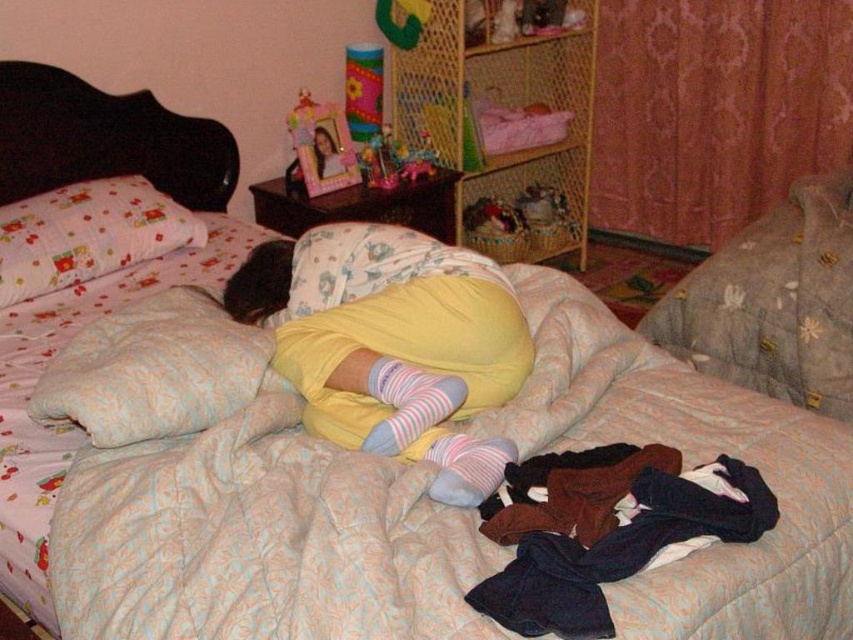
Question: In this image, where is striped cotton socks at center located relative to plastic pink toy at center?

Choices:
 (A) right
 (B) left

Answer: (A)

Question: Estimate the real-world distances between objects in this image. Which object is farther from the plastic pink toy at center?

Choices:
 (A) pink striped sock at lower center
 (B) fluffy cotton pillow at upper left

Answer: (A)

Question: Is dark brown cotton shirt at lower right above matte plastic photo frame at upper center?

Choices:
 (A) yes
 (B) no

Answer: (B)

Question: Is dark brown cotton shirt at lower right thinner than matte plastic photo frame at upper center?

Choices:
 (A) no
 (B) yes

Answer: (A)

Question: Which is farther from the dark brown cotton shirt at lower right?

Choices:
 (A) fluffy white pillow at upper left
 (B) plastic pink toy at center

Answer: (B)

Question: Estimate the real-world distances between objects in this image. Which object is farther from the plastic pink toy at center?

Choices:
 (A) striped cotton socks at center
 (B) fluffy cotton pillow at upper left
 (C) fluffy white pillow at upper left

Answer: (A)